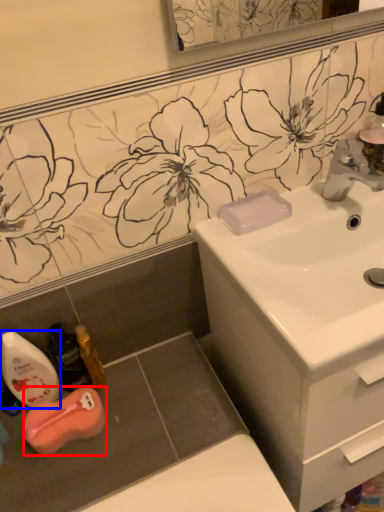
Question: Among these objects, which one is nearest to the camera, chiffonier (highlighted by a red box) or mouthwash (highlighted by a blue box)?

Choices:
 (A) chiffonier
 (B) mouthwash

Answer: (B)